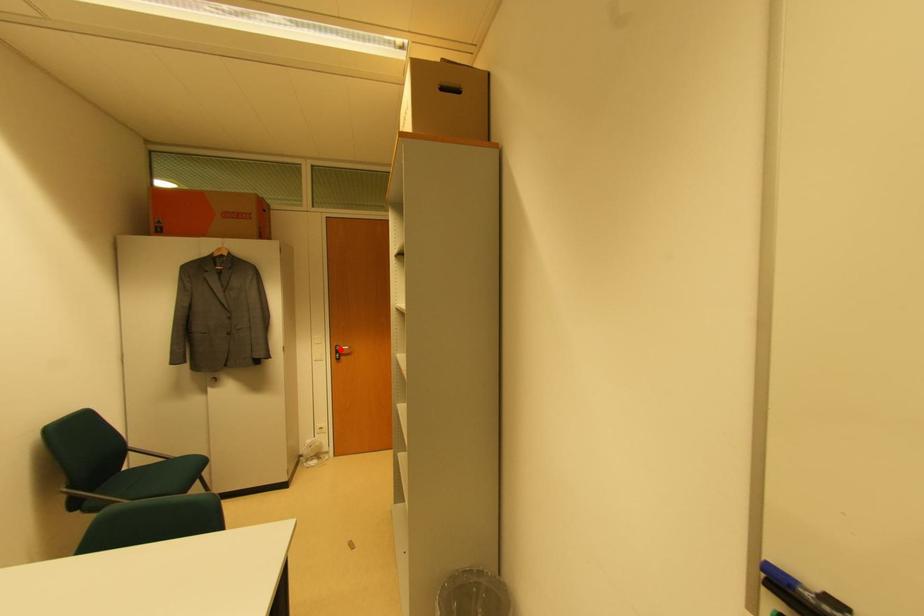
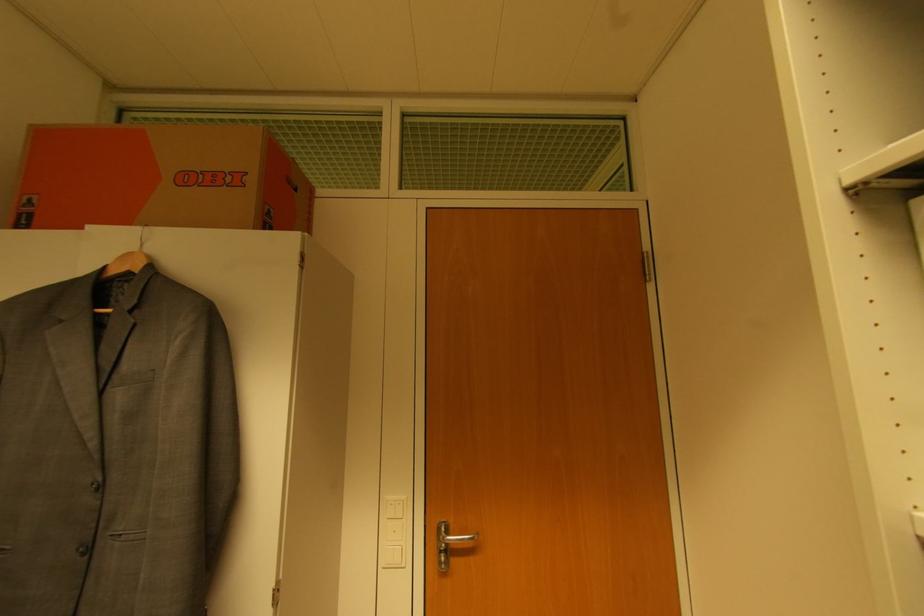
In the second image, find the point that corresponds to the highlighted location in the first image.

(448, 533)